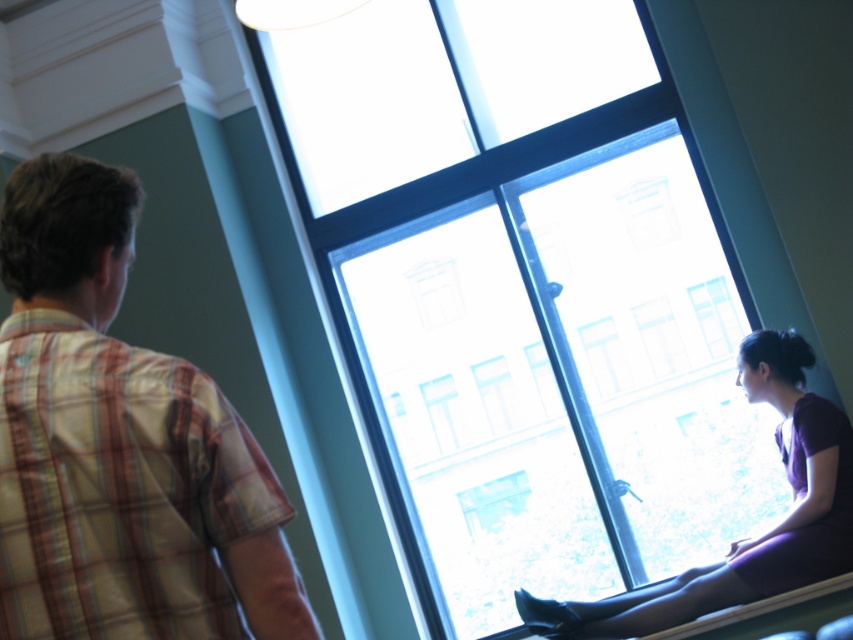
Is plaid cotton shirt at left bigger than matte purple dress at window?

Actually, plaid cotton shirt at left might be smaller than matte purple dress at window.

Is point (91, 220) behind point (784, 348)?

No.

Image resolution: width=853 pixels, height=640 pixels. In order to click on plaid cotton shirt at left in this screenshot , I will do `click(119, 445)`.

Can you confirm if transparent glass window at center is thinner than matte purple dress at window?

Incorrect, transparent glass window at center's width is not less than matte purple dress at window's.

Can you confirm if transparent glass window at center is taller than matte purple dress at window?

Yes.

Between point (712, 362) and point (801, 413), which one is positioned in front?

Point (801, 413) is more forward.

Locate an element on the screen. transparent glass window at center is located at coordinates (511, 244).

Is transparent glass window at center positioned in front of plaid cotton shirt at left?

No, it is behind plaid cotton shirt at left.

Is point (648, 372) behind point (74, 513)?

Yes, it is.

Which is behind, point (711, 323) or point (253, 464)?

The point (711, 323) is behind.

Where is `transparent glass window at center`? This screenshot has height=640, width=853. transparent glass window at center is located at coordinates (511, 244).